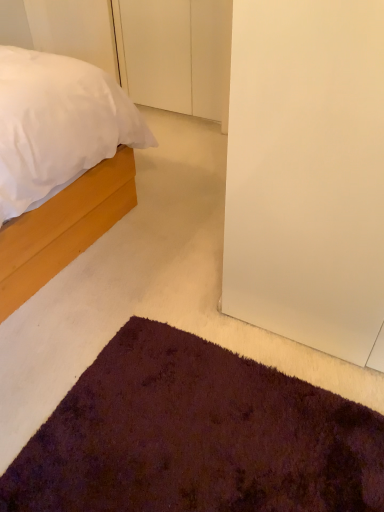
Question: Considering the relative sizes of white matte door at upper center and matte wood bed at left in the image provided, is white matte door at upper center thinner than matte wood bed at left?

Choices:
 (A) yes
 (B) no

Answer: (A)

Question: Are white matte door at upper center and matte wood bed at left beside each other?

Choices:
 (A) yes
 (B) no

Answer: (B)

Question: Is white matte door at upper center oriented towards matte wood bed at left?

Choices:
 (A) yes
 (B) no

Answer: (A)

Question: Does white matte door at upper center have a greater width compared to matte wood bed at left?

Choices:
 (A) yes
 (B) no

Answer: (B)

Question: Would you say white matte door at upper center is a long distance from matte wood bed at left?

Choices:
 (A) yes
 (B) no

Answer: (A)

Question: Is white matte door at upper center not within matte wood bed at left?

Choices:
 (A) no
 (B) yes

Answer: (B)

Question: Is matte wood bed at left located outside white matte door at upper center?

Choices:
 (A) no
 (B) yes

Answer: (B)

Question: Considering the relative sizes of matte wood bed at left and white matte door at upper center in the image provided, is matte wood bed at left bigger than white matte door at upper center?

Choices:
 (A) no
 (B) yes

Answer: (B)

Question: Considering the relative sizes of matte wood bed at left and white matte door at upper center in the image provided, is matte wood bed at left thinner than white matte door at upper center?

Choices:
 (A) yes
 (B) no

Answer: (B)

Question: Is matte wood bed at left wider than white matte door at upper center?

Choices:
 (A) yes
 (B) no

Answer: (A)

Question: Are matte wood bed at left and white matte door at upper center located far from each other?

Choices:
 (A) no
 (B) yes

Answer: (B)

Question: Does matte wood bed at left turn towards white matte door at upper center?

Choices:
 (A) no
 (B) yes

Answer: (A)

Question: Is white matte door at upper center in front of or behind matte wood bed at left in the image?

Choices:
 (A) front
 (B) behind

Answer: (B)